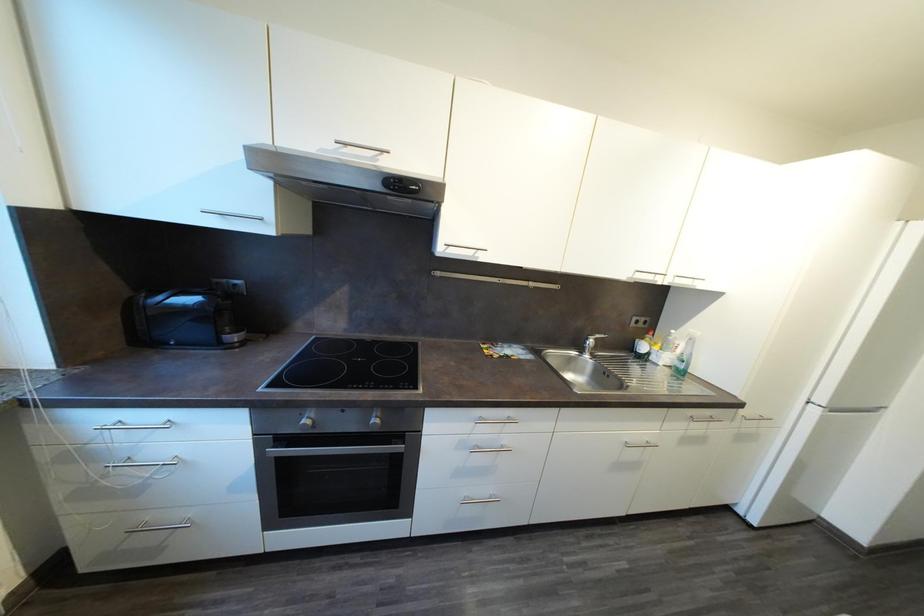
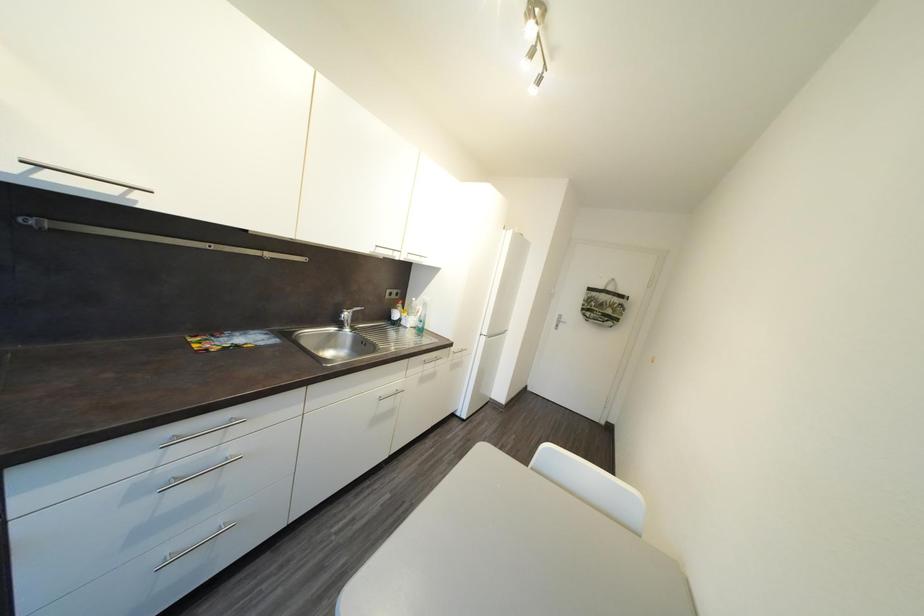
Question: How did the camera likely rotate?

Choices:
 (A) Left
 (B) Right
 (C) Up
 (D) Down

Answer: (B)